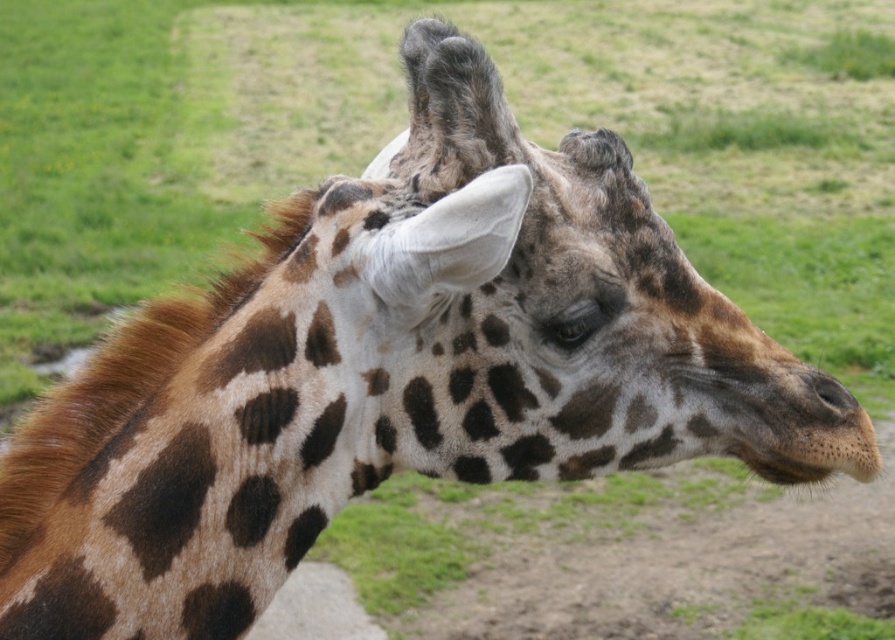
Question: Which point appears farthest from the camera in this image?

Choices:
 (A) (459, 360)
 (B) (811, 387)

Answer: (B)

Question: Considering the real-world distances, which object is closest to the brown textured nose at lower right?

Choices:
 (A) brown textured fur at center
 (B) brown spotted fur at center

Answer: (B)

Question: Can you confirm if brown spotted fur at center is bigger than brown textured fur at center?

Choices:
 (A) yes
 (B) no

Answer: (A)

Question: Where is brown textured fur at center located in relation to brown textured nose at lower right in the image?

Choices:
 (A) above
 (B) below

Answer: (B)

Question: Among these points, which one is nearest to the camera?

Choices:
 (A) (842, 420)
 (B) (134, 419)
 (C) (697, 288)

Answer: (B)

Question: Can you confirm if brown spotted fur at center is thinner than brown textured nose at lower right?

Choices:
 (A) yes
 (B) no

Answer: (B)